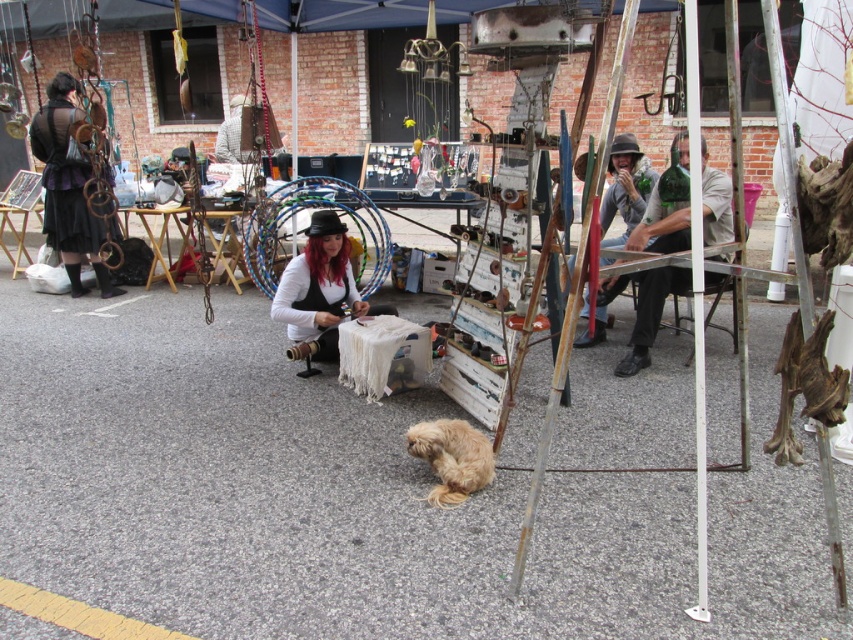
Who is lower down, white matte fabric at center or fuzzy brown dog at center?

fuzzy brown dog at center is below.

Which is more to the left, white matte fabric at center or fuzzy brown dog at center?

white matte fabric at center is more to the left.

Is point (285, 307) positioned after point (428, 442)?

Yes.

The width and height of the screenshot is (853, 640). I want to click on white matte fabric at center, so click(x=320, y=291).

Does matte black dress at left have a greater height compared to white matte fabric at center?

Indeed, matte black dress at left has a greater height compared to white matte fabric at center.

The height and width of the screenshot is (640, 853). I want to click on matte black dress at left, so click(70, 188).

Describe the element at coordinates (70, 188) in the screenshot. I see `matte black dress at left` at that location.

Is point (94, 252) positioned in front of point (451, 468)?

No.

You are a GUI agent. You are given a task and a screenshot of the screen. Output one action in this format:
    pyautogui.click(x=<x>, y=<y>)
    Task: Click on the matte black dress at left
    The height and width of the screenshot is (640, 853).
    Given the screenshot: What is the action you would take?
    pyautogui.click(x=70, y=188)